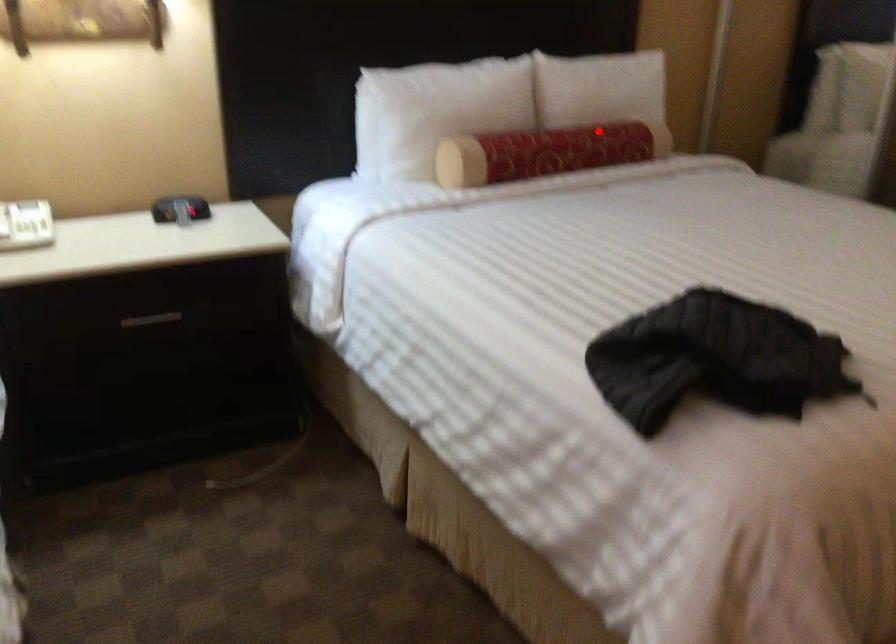
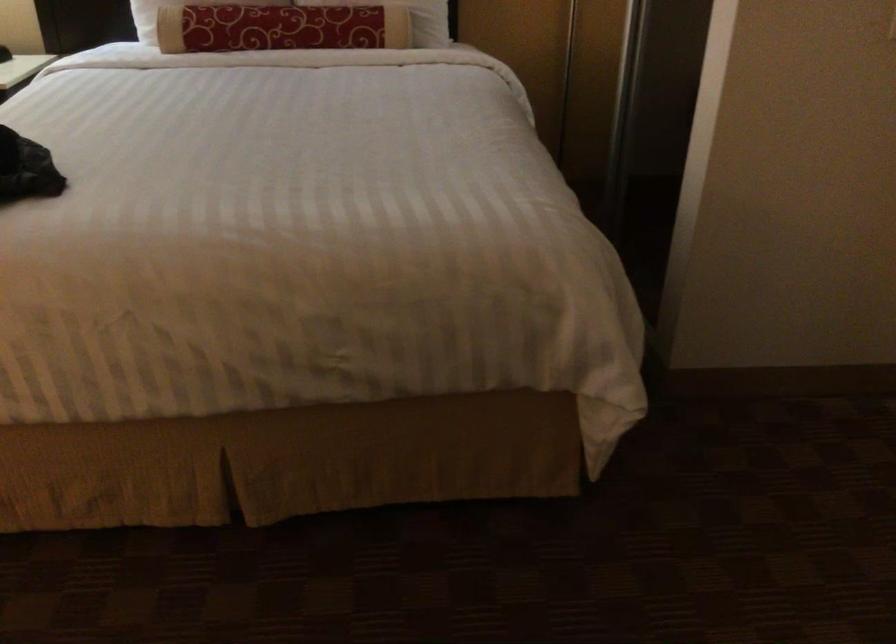
Where in the second image is the point corresponding to the highlighted location from the first image?

(311, 15)